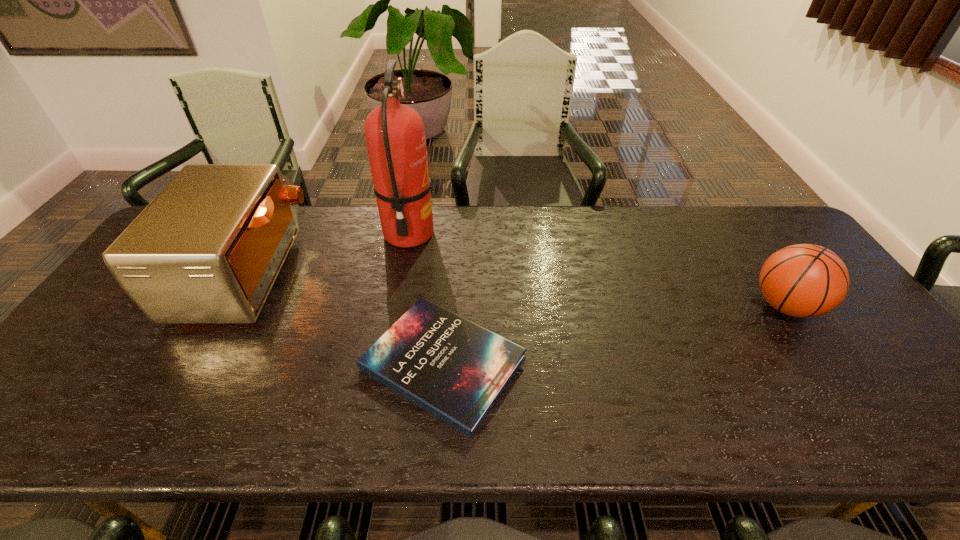
The width and height of the screenshot is (960, 540). Identify the location of vacant space that satisfies the following two spatial constraints: 1. on the side of the rightmost object with the nozzle and handle; 2. on the left side of the fire extinguisher. (396, 306).

In order to click on free space that satisfies the following two spatial constraints: 1. on the back side of the rightmost object; 2. on the right side of the hardback book in this screenshot , I will do `click(447, 306)`.

Where is `free spot that satisfies the following two spatial constraints: 1. on the back side of the basketball; 2. on the door side of the leftmost object`? Image resolution: width=960 pixels, height=540 pixels. free spot that satisfies the following two spatial constraints: 1. on the back side of the basketball; 2. on the door side of the leftmost object is located at coordinates (764, 274).

You are a GUI agent. You are given a task and a screenshot of the screen. Output one action in this format:
    pyautogui.click(x=<x>, y=<y>)
    Task: Click on the free space that satisfies the following two spatial constraints: 1. on the door side of the rightmost object; 2. on the left side of the third shortest object
    This screenshot has width=960, height=540.
    Given the screenshot: What is the action you would take?
    pyautogui.click(x=231, y=306)

You are a GUI agent. You are given a task and a screenshot of the screen. Output one action in this format:
    pyautogui.click(x=<x>, y=<y>)
    Task: Click on the free space that satisfies the following two spatial constraints: 1. on the side of the rightmost object with the nozzle and handle; 2. on the right side of the tallest object
    This screenshot has width=960, height=540.
    Given the screenshot: What is the action you would take?
    pyautogui.click(x=396, y=306)

You are a GUI agent. You are given a task and a screenshot of the screen. Output one action in this format:
    pyautogui.click(x=<x>, y=<y>)
    Task: Click on the free point that satisfies the following two spatial constraints: 1. on the door side of the second shortest object; 2. on the left side of the toaster oven
    The image size is (960, 540).
    Given the screenshot: What is the action you would take?
    pyautogui.click(x=231, y=306)

This screenshot has width=960, height=540. In order to click on free space that satisfies the following two spatial constraints: 1. on the door side of the third shortest object; 2. on the back side of the second shortest object in this screenshot , I will do `click(231, 306)`.

Locate an element on the screen. Image resolution: width=960 pixels, height=540 pixels. vacant space that satisfies the following two spatial constraints: 1. on the side of the second shortest object with the nozzle and handle; 2. on the right side of the fire extinguisher is located at coordinates (396, 306).

Find the location of a particular element. This screenshot has width=960, height=540. vacant region that satisfies the following two spatial constraints: 1. on the side of the tallest object with the nozzle and handle; 2. on the right side of the shortest object is located at coordinates (385, 363).

You are a GUI agent. You are given a task and a screenshot of the screen. Output one action in this format:
    pyautogui.click(x=<x>, y=<y>)
    Task: Click on the free space that satisfies the following two spatial constraints: 1. on the side of the fire extinguisher with the nozzle and handle; 2. on the back side of the basketball
    
    Given the screenshot: What is the action you would take?
    pyautogui.click(x=396, y=306)